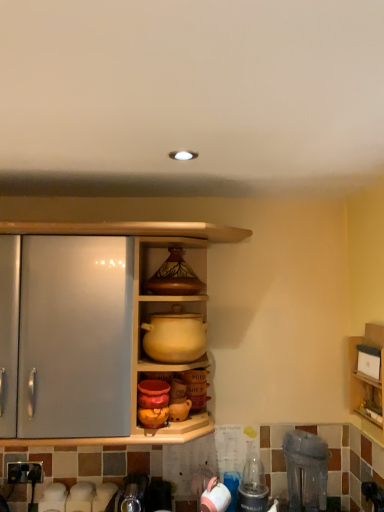
Question: Looking at the image, does transparent plastic blender at lower right, arranged as the first appliance when viewed from the right, seem bigger or smaller compared to wooden shelf at right, acting as the 1th shelf starting from the right?

Choices:
 (A) big
 (B) small

Answer: (A)

Question: Relative to wooden shelf at right, acting as the 1th shelf starting from the right, is transparent plastic blender at lower right, arranged as the first appliance when viewed from the right, in front or behind?

Choices:
 (A) front
 (B) behind

Answer: (A)

Question: Based on their relative distances, which object is nearer to the wooden shelf at right, acting as the second shelf starting from the left?

Choices:
 (A) clear plastic bottle at lower right
 (B) matte ceramic vase at upper center
 (C) transparent plastic blender at lower right, arranged as the first appliance when viewed from the right
 (D) white glossy kettle at lower center, which is the first appliance from left to right
 (E) matte yellow pot at center, acting as the first shelf starting from the left

Answer: (C)

Question: Estimate the real-world distances between objects in this image. Which object is closer to the matte ceramic vase at upper center?

Choices:
 (A) clear plastic bottle at lower right
 (B) wooden shelf at right, acting as the second shelf starting from the left
 (C) white glossy kettle at lower center, the second appliance from the right
 (D) matte yellow pot at center, acting as the first shelf starting from the left
 (E) transparent plastic blender at lower right, the second appliance when ordered from left to right

Answer: (D)